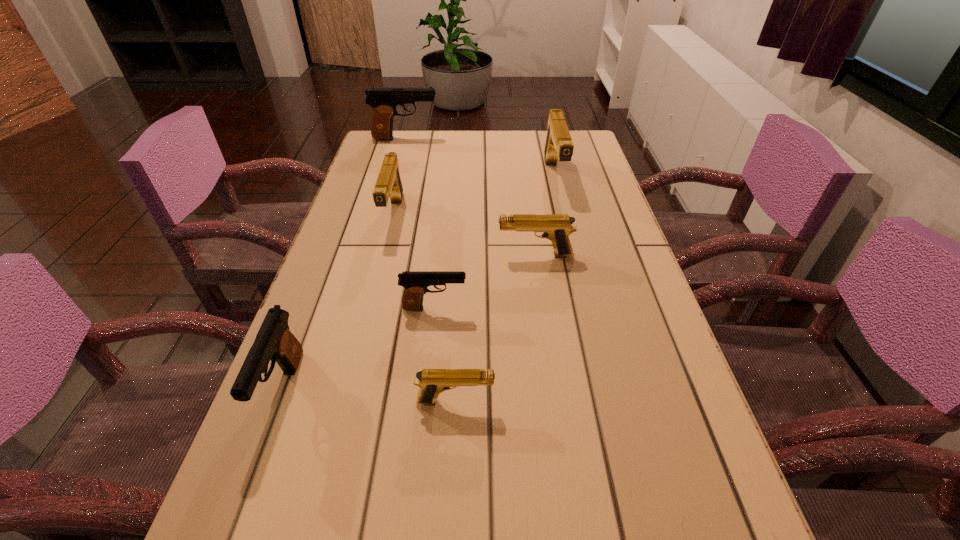
Identify the location of unoccupied position between the biggest tan pistol and the second farthest black pistol. (494, 242).

Select which object appears as the fourth closest to the smallest black pistol. Please provide its 2D coordinates. Your answer should be formatted as a tuple, i.e. [(x, y)], where the tuple contains the x and y coordinates of a point satisfying the conditions above.

[(388, 184)]

Locate which object ranks sixth in proximity to the nearest black pistol. Please provide its 2D coordinates. Your answer should be formatted as a tuple, i.e. [(x, y)], where the tuple contains the x and y coordinates of a point satisfying the conditions above.

[(384, 100)]

What are the coordinates of `pistol that can be found as the second closest to the nearest black pistol` in the screenshot? It's located at (432, 382).

Choose which pistol is the fifth nearest neighbor to the second biggest tan pistol. Please provide its 2D coordinates. Your answer should be formatted as a tuple, i.e. [(x, y)], where the tuple contains the x and y coordinates of a point satisfying the conditions above.

[(558, 145)]

Locate which black pistol ranks second in proximity to the fifth farthest object. Please provide its 2D coordinates. Your answer should be formatted as a tuple, i.e. [(x, y)], where the tuple contains the x and y coordinates of a point satisfying the conditions above.

[(384, 100)]

Locate which black pistol ranks in proximity to the fourth nearest object. Please provide its 2D coordinates. Your answer should be formatted as a tuple, i.e. [(x, y)], where the tuple contains the x and y coordinates of a point satisfying the conditions above.

[(415, 283)]

Identify which tan pistol is the nearest to the biggest black pistol. Please provide its 2D coordinates. Your answer should be formatted as a tuple, i.e. [(x, y)], where the tuple contains the x and y coordinates of a point satisfying the conditions above.

[(388, 184)]

Locate an element on the screen. tan pistol that is the second closest to the fifth farthest pistol is located at coordinates (432, 382).

This screenshot has height=540, width=960. In order to click on vacant region that satisfies the following two spatial constraints: 1. at the barrel of the second smallest tan pistol; 2. at the barrel of the second biggest black pistol in this screenshot , I will do `click(555, 390)`.